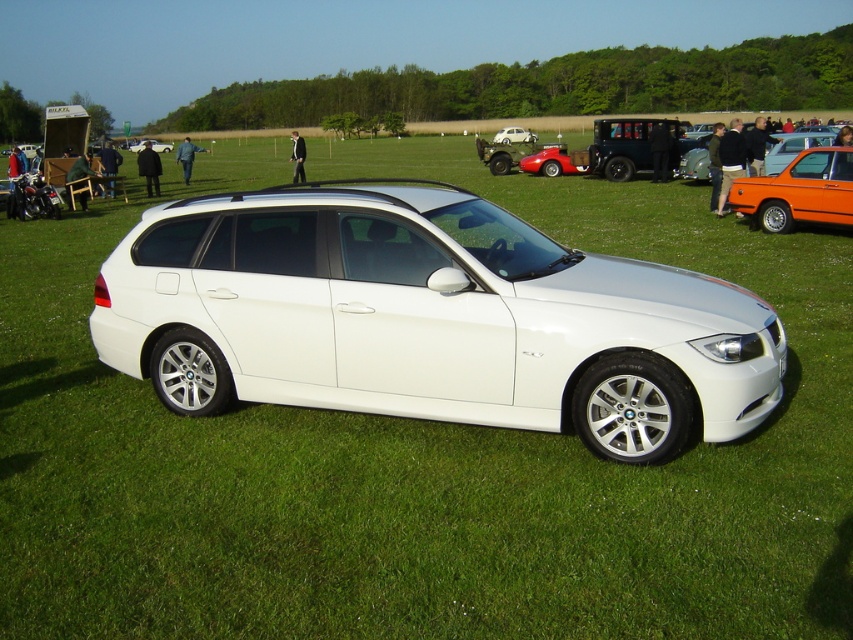
Question: Which object appears farthest from the camera in this image?

Choices:
 (A) orange metallic car at right
 (B) metallic silver car at center
 (C) white matte hatchback at center
 (D) metallic orange car at right

Answer: (C)

Question: Among these points, which one is nearest to the camera?

Choices:
 (A) (795, 141)
 (B) (834, 216)
 (C) (157, 147)

Answer: (B)

Question: Which of the following is the farthest from the observer?

Choices:
 (A) metallic silver car at center
 (B) white metallic car at center
 (C) white matte hatchback at center
 (D) orange metallic car at right

Answer: (C)

Question: Is orange metallic car at right to the right of metallic silver car at center from the viewer's perspective?

Choices:
 (A) yes
 (B) no

Answer: (B)

Question: Is orange metallic car at right wider than white matte hatchback at center?

Choices:
 (A) yes
 (B) no

Answer: (B)

Question: Does metallic orange car at right have a smaller size compared to metallic silver car at center?

Choices:
 (A) no
 (B) yes

Answer: (B)